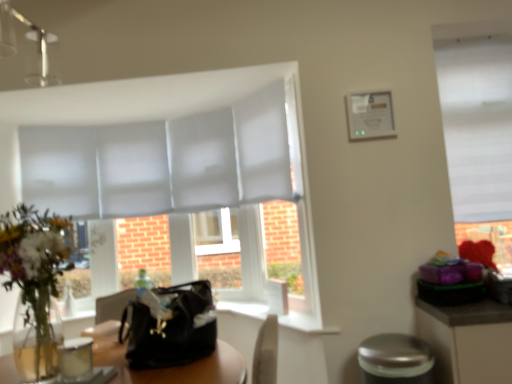
Question: Does white smooth window sill at center have a lesser width compared to black leather handbag at center?

Choices:
 (A) yes
 (B) no

Answer: (A)

Question: Is white smooth window sill at center outside black leather handbag at center?

Choices:
 (A) no
 (B) yes

Answer: (B)

Question: From the image's perspective, would you say white smooth window sill at center is shown under black leather handbag at center?

Choices:
 (A) yes
 (B) no

Answer: (A)

Question: Does white smooth window sill at center have a greater width compared to black leather handbag at center?

Choices:
 (A) yes
 (B) no

Answer: (B)

Question: Does white smooth window sill at center touch black leather handbag at center?

Choices:
 (A) yes
 (B) no

Answer: (B)

Question: From their relative heights in the image, would you say white matte window at upper right is taller or shorter than translucent glass vase at left?

Choices:
 (A) tall
 (B) short

Answer: (A)

Question: In the image, is white matte window at upper right positioned in front of or behind translucent glass vase at left?

Choices:
 (A) behind
 (B) front

Answer: (A)

Question: Is point (437, 44) positioned closer to the camera than point (41, 244)?

Choices:
 (A) closer
 (B) farther

Answer: (B)

Question: From the image's perspective, is white matte window at upper right located above or below translucent glass vase at left?

Choices:
 (A) above
 (B) below

Answer: (A)

Question: Considering the positions of point (27, 215) and point (310, 329), is point (27, 215) closer or farther from the camera than point (310, 329)?

Choices:
 (A) closer
 (B) farther

Answer: (A)

Question: Which is correct: translucent glass vase at left is inside white smooth window sill at center, or outside of it?

Choices:
 (A) inside
 (B) outside

Answer: (B)

Question: Considering the positions of translucent glass vase at left and white smooth window sill at center in the image, is translucent glass vase at left bigger or smaller than white smooth window sill at center?

Choices:
 (A) big
 (B) small

Answer: (A)

Question: In terms of height, does translucent glass vase at left look taller or shorter compared to white smooth window sill at center?

Choices:
 (A) tall
 (B) short

Answer: (A)

Question: From the image's perspective, relative to translucent glass vase at left, is silver metallic bar stool at lower right above or below?

Choices:
 (A) above
 (B) below

Answer: (B)

Question: Is point (372, 337) closer or farther from the camera than point (24, 324)?

Choices:
 (A) farther
 (B) closer

Answer: (B)